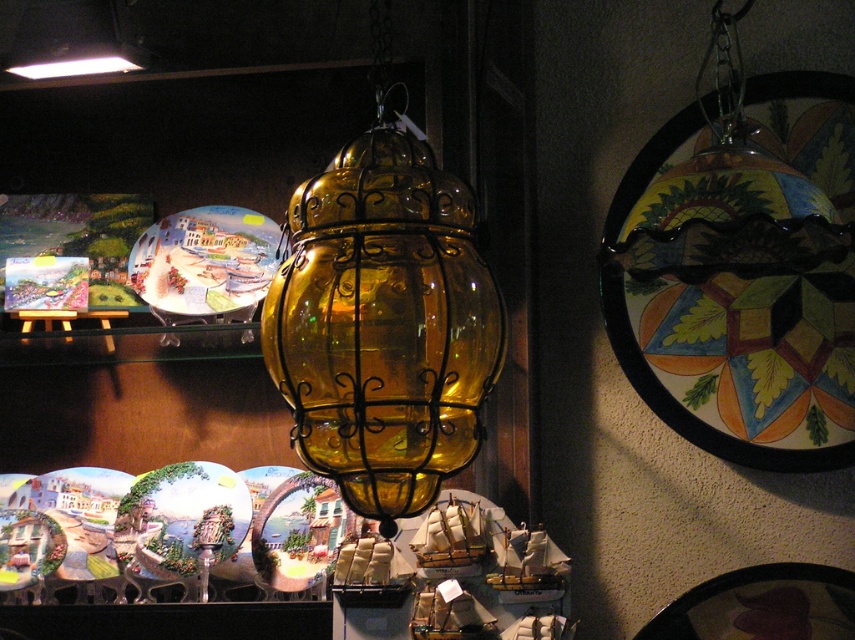
Question: Is amber glass lantern at center positioned before matte ceramic plate at upper center?

Choices:
 (A) no
 (B) yes

Answer: (B)

Question: Can you confirm if amber glass lantern at center is positioned to the left of matte ceramic plate at upper center?

Choices:
 (A) yes
 (B) no

Answer: (B)

Question: Which point appears closest to the camera in this image?

Choices:
 (A) (392, 353)
 (B) (195, 314)

Answer: (A)

Question: Does amber glass lantern at center have a greater width compared to matte ceramic plate at upper center?

Choices:
 (A) yes
 (B) no

Answer: (A)